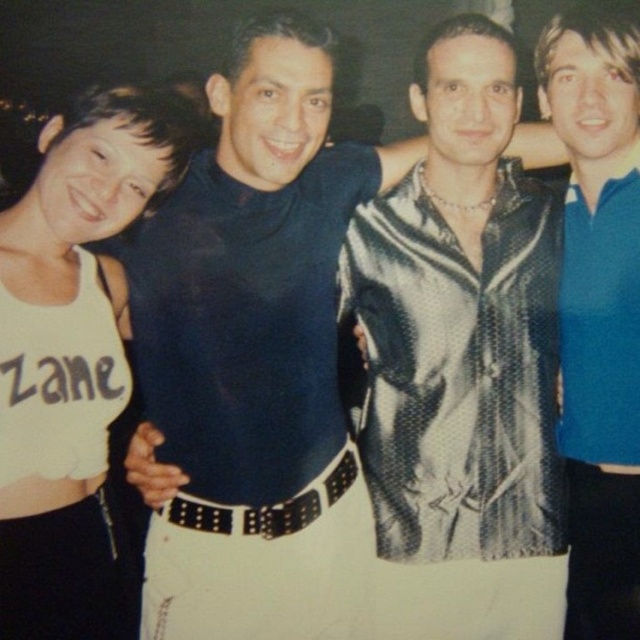
Between matte black turtleneck at center and shiny metallic jacket at center, which one has less height?

Standing shorter between the two is matte black turtleneck at center.

Does matte black turtleneck at center have a larger size compared to shiny metallic jacket at center?

Indeed, matte black turtleneck at center has a larger size compared to shiny metallic jacket at center.

The height and width of the screenshot is (640, 640). What are the coordinates of `matte black turtleneck at center` in the screenshot? It's located at (276, 385).

Where is `shiny metallic jacket at center`? shiny metallic jacket at center is located at coordinates 461,362.

Does shiny metallic jacket at center appear on the left side of blue smooth polo shirt at right?

Indeed, shiny metallic jacket at center is positioned on the left side of blue smooth polo shirt at right.

Between point (400, 278) and point (611, 124), which one is positioned behind?

Positioned behind is point (400, 278).

This screenshot has height=640, width=640. Find the location of `shiny metallic jacket at center`. shiny metallic jacket at center is located at coordinates (461, 362).

Between matte black turtleneck at center and blue smooth polo shirt at right, which one is positioned higher?

matte black turtleneck at center is above.

Is matte black turtleneck at center taller than blue smooth polo shirt at right?

No.

Does point (348, 188) lie in front of point (628, 237)?

No, it is not.

I want to click on matte black turtleneck at center, so click(276, 385).